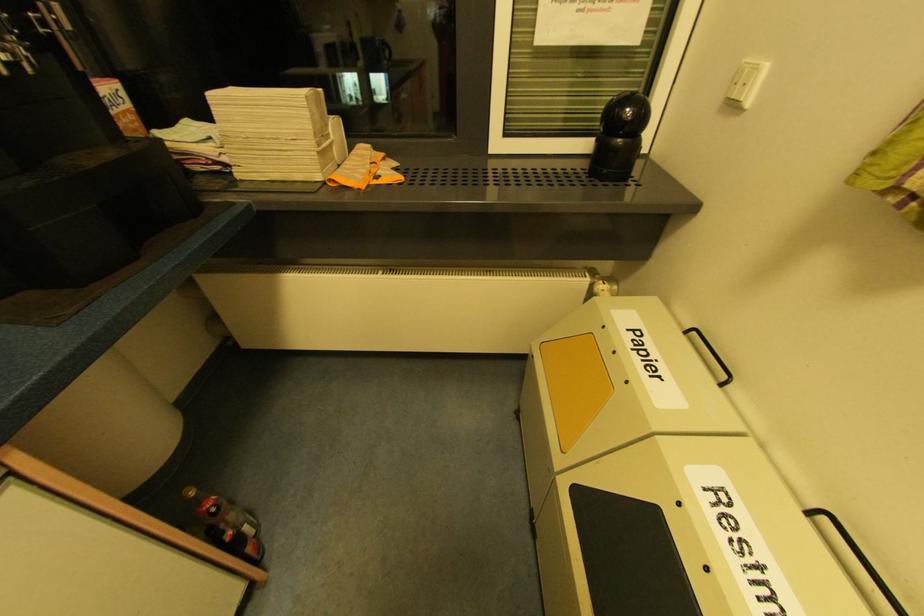
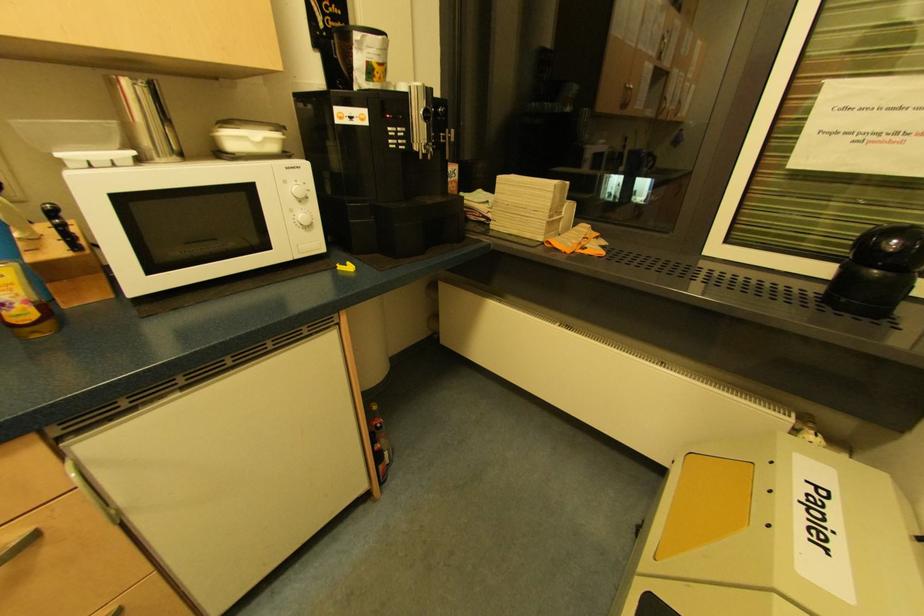
Locate, in the second image, the point that corresponds to point 630,110 in the first image.

(897, 241)